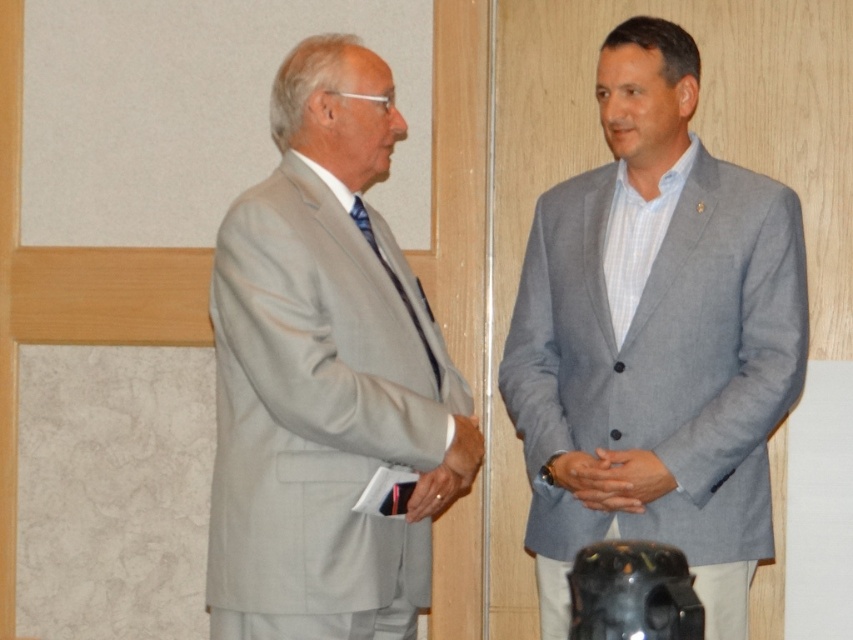
How much distance is there between gray matte suit at left and smooth gray hands at center?

gray matte suit at left and smooth gray hands at center are 19.57 inches apart from each other.

Between gray matte suit at left and smooth gray hands at center, which one is positioned lower?

Result: smooth gray hands at center is lower down.

Describe the element at coordinates (326, 376) in the screenshot. I see `gray matte suit at left` at that location.

Identify the location of gray matte suit at left. The height and width of the screenshot is (640, 853). (326, 376).

Who is lower down, gray fabric suit at right or smooth gray hands at center?

Positioned lower is smooth gray hands at center.

Who is positioned more to the left, gray fabric suit at right or smooth gray hands at center?

Positioned to the left is smooth gray hands at center.

What do you see at coordinates (656, 333) in the screenshot?
I see `gray fabric suit at right` at bounding box center [656, 333].

Where is `gray fabric suit at right`? gray fabric suit at right is located at coordinates (656, 333).

Between point (546, 579) and point (310, 253), which one is positioned behind?

The point (546, 579) is more distant.

Between gray fabric suit at right and gray matte suit at left, which one is positioned higher?

gray matte suit at left

Does point (583, 349) come in front of point (332, 362)?

No, (583, 349) is further to viewer.

Where is `gray fabric suit at right`? The width and height of the screenshot is (853, 640). gray fabric suit at right is located at coordinates (656, 333).